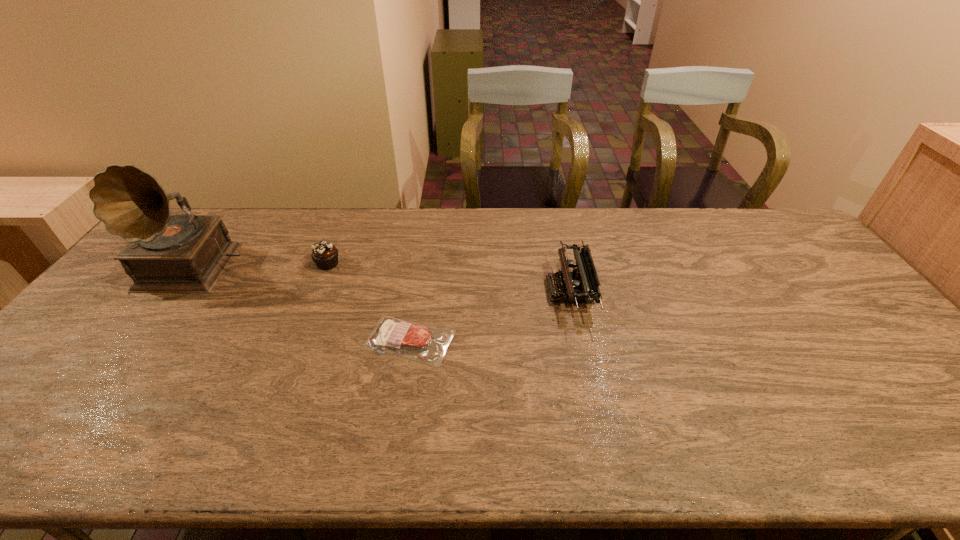
The image size is (960, 540). In order to click on vacant space located on the typing side of the second tallest object in this screenshot , I will do `click(448, 291)`.

Identify the location of vacant area situated on the typing side of the second tallest object. (527, 291).

Find the location of a particular element. Image resolution: width=960 pixels, height=540 pixels. vacant space situated on the front of the third tallest object is located at coordinates (319, 286).

The width and height of the screenshot is (960, 540). Find the location of `free spot located 0.250m on the back of the steak`. free spot located 0.250m on the back of the steak is located at coordinates point(421,258).

Where is `object present at the far edge`? object present at the far edge is located at coordinates (186, 253).

Locate an element on the screen. This screenshot has height=540, width=960. object situated at the left edge is located at coordinates (186, 253).

Where is `object positioned at the far left corner`? The width and height of the screenshot is (960, 540). object positioned at the far left corner is located at coordinates (186, 253).

Find the location of `free space at the far edge of the desktop`. free space at the far edge of the desktop is located at coordinates (246, 214).

The height and width of the screenshot is (540, 960). I want to click on free space at the near edge of the desktop, so click(372, 438).

Identify the location of free space at the far right corner of the desktop. Image resolution: width=960 pixels, height=540 pixels. (795, 231).